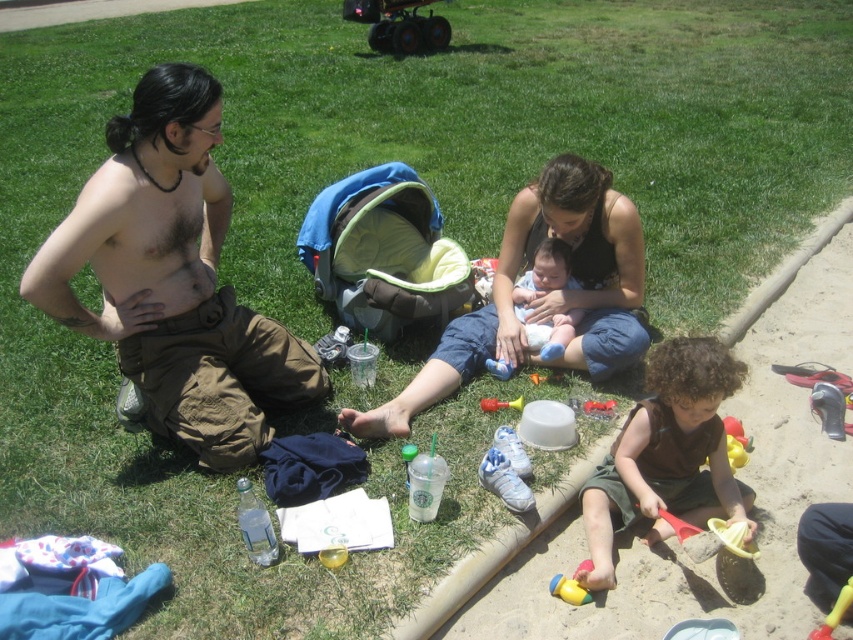
Question: Based on their relative distances, which object is nearer to the brown cotton pants at left?

Choices:
 (A) rubber yellow toy at lower center
 (B) curly-haired brown shirt at lower right
 (C) clear plastic bottle at lower center
 (D) fine-grained sand at lower right

Answer: (C)

Question: Does fine-grained sand at lower right appear on the right side of hairy skin at center?

Choices:
 (A) yes
 (B) no

Answer: (A)

Question: Does fine-grained sand at lower right have a lesser width compared to yellow plastic toy at lower right?

Choices:
 (A) yes
 (B) no

Answer: (B)

Question: Which of the following is the closest to the observer?

Choices:
 (A) (643, 589)
 (B) (692, 426)
 (C) (47, 256)

Answer: (C)

Question: Does matte black tank top at center have a smaller size compared to curly-haired brown shirt at lower right?

Choices:
 (A) yes
 (B) no

Answer: (B)

Question: Which point is farther to the camera?

Choices:
 (A) green fabric baby carriage at center
 (B) hairy skin at center

Answer: (A)